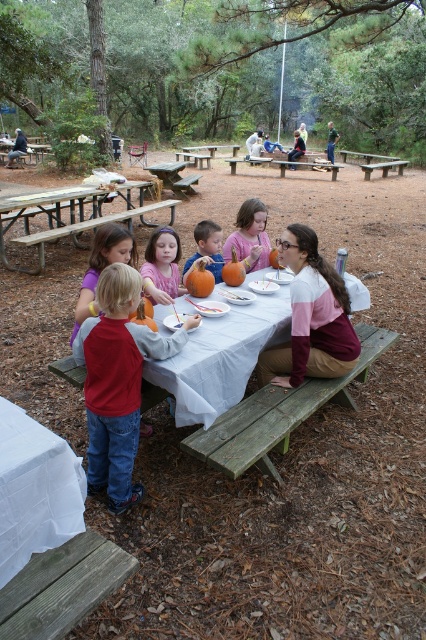
Question: Does matte orange pumpkin at center come behind orange matte pumpkin at center?

Choices:
 (A) yes
 (B) no

Answer: (A)

Question: From the image, what is the correct spatial relationship of pink matte pumpkin at center in relation to white glossy plate at center?

Choices:
 (A) left
 (B) right

Answer: (A)

Question: Does white cloth table at lower left lie in front of pink matte pumpkin at center?

Choices:
 (A) yes
 (B) no

Answer: (A)

Question: Which of the following is the closest to the observer?

Choices:
 (A) click(x=40, y=518)
 (B) click(x=238, y=365)
 (C) click(x=121, y=349)

Answer: (A)

Question: Estimate the real-world distances between objects in this image. Which object is closer to the matte orange pumpkin at center?

Choices:
 (A) pink matte pumpkin at center
 (B) matte pink shirt at center
 (C) white glossy plate at center
 (D) orange matte pumpkin at center

Answer: (B)

Question: Which of the following is the closest to the observer?

Choices:
 (A) orange matte pumpkin at center
 (B) matte pink shirt at center
 (C) white cloth-covered table at center

Answer: (C)